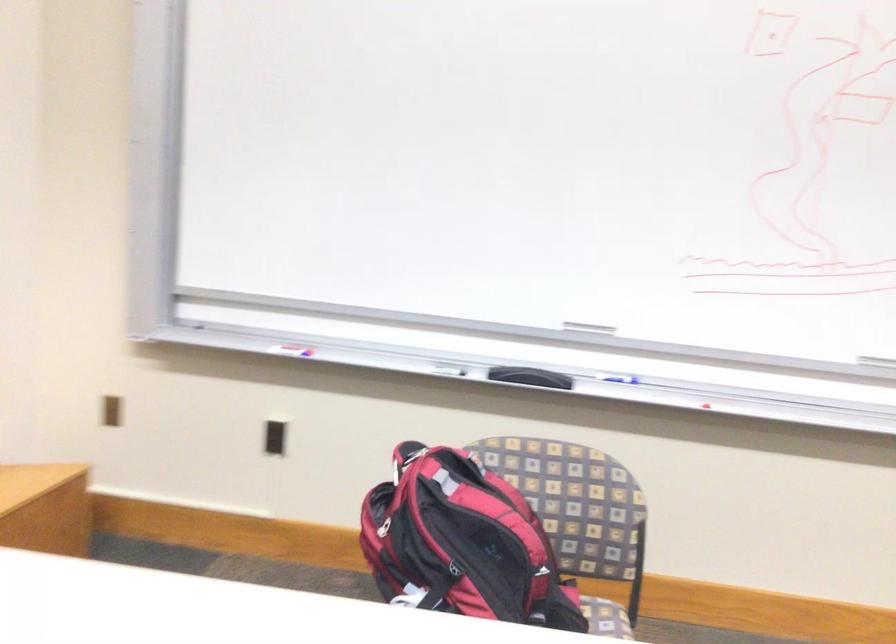
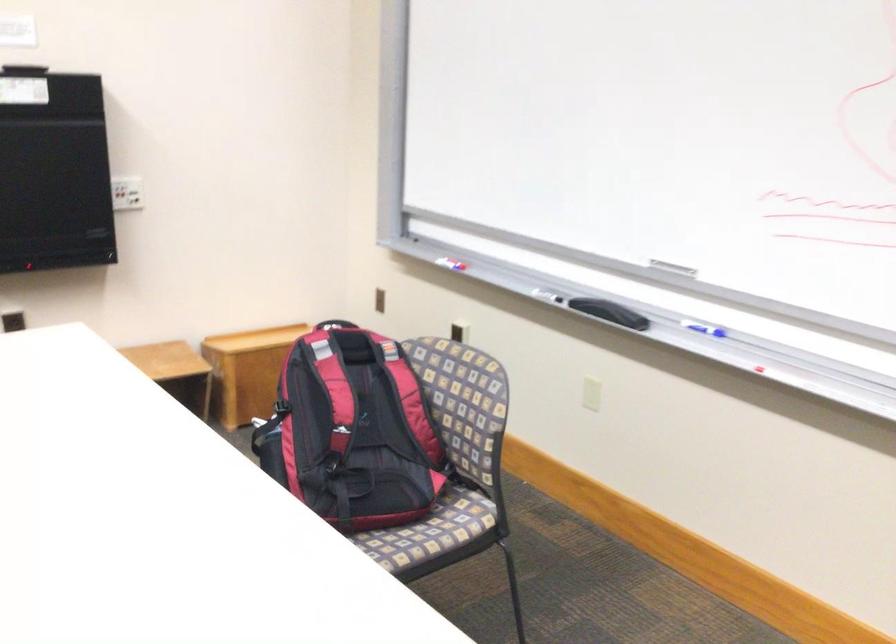
Locate, in the second image, the point that corresponds to (x=497, y=529) in the first image.

(334, 391)